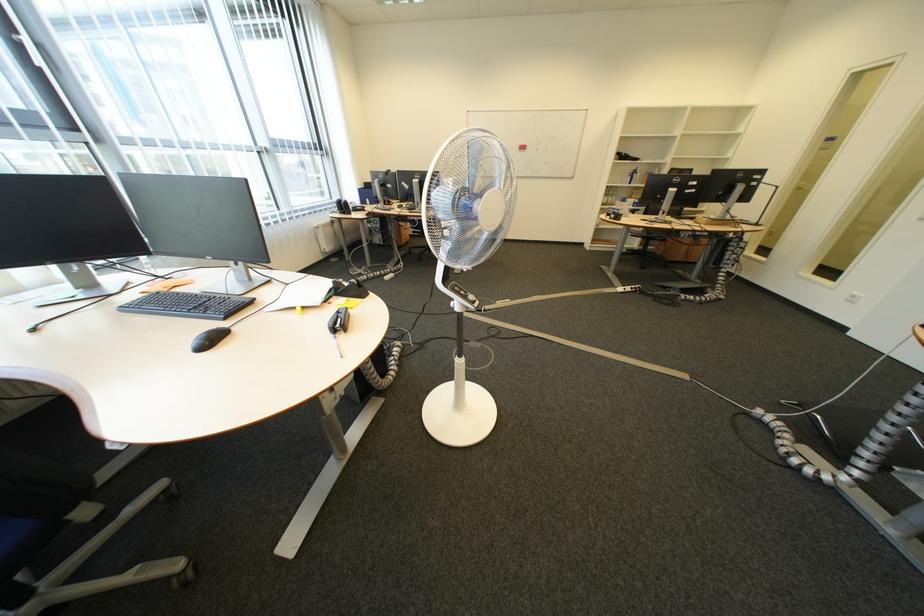
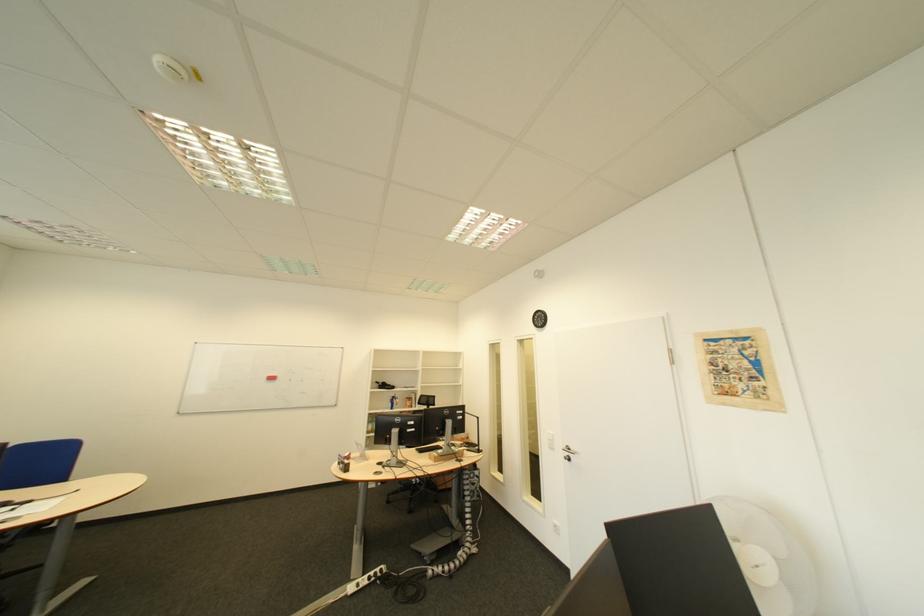
Find the pixel in the second image that matches (x=536, y=148) in the first image.

(285, 379)